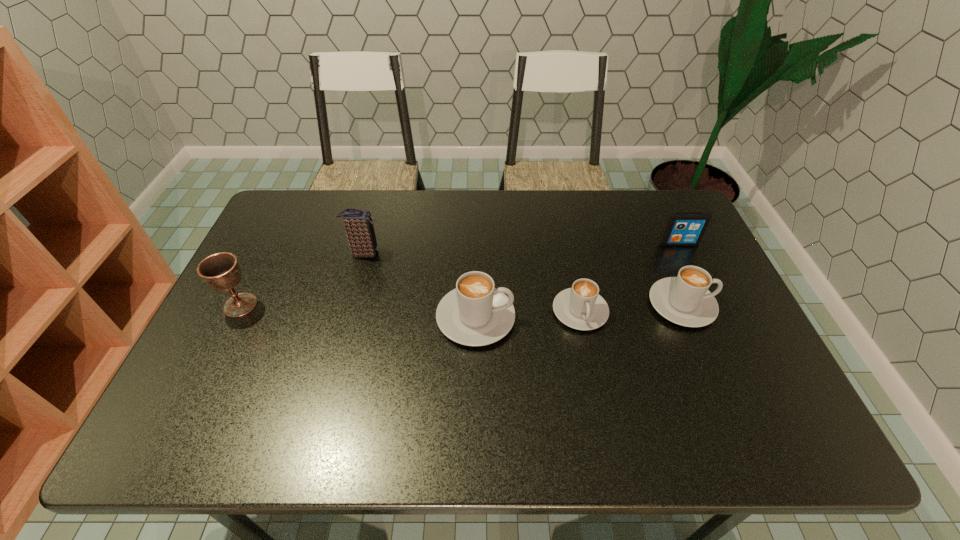
Identify the location of vacant space located 0.060m to the right of the rightmost cappuccino. (736, 305).

Image resolution: width=960 pixels, height=540 pixels. Identify the location of free space located 0.200m on the right of the leftmost object. (330, 305).

Identify the location of vacant space situated 0.070m with the zip open on the fifth nearest object. (403, 253).

Find the location of a particular element. The height and width of the screenshot is (540, 960). free space located on the front screen of the farthest object is located at coordinates (687, 261).

The height and width of the screenshot is (540, 960). I want to click on object that is positioned at the left edge, so [x=221, y=271].

Identify the location of cappuccino that is at the right edge. (685, 300).

Where is `iPod located at the right edge`? The image size is (960, 540). iPod located at the right edge is located at coordinates (683, 228).

Identify the location of vacant space at the far edge. (335, 217).

Identify the location of vacant region at the left edge of the desktop. This screenshot has width=960, height=540. (279, 243).

The width and height of the screenshot is (960, 540). In order to click on vacant space at the right edge in this screenshot , I will do `click(728, 312)`.